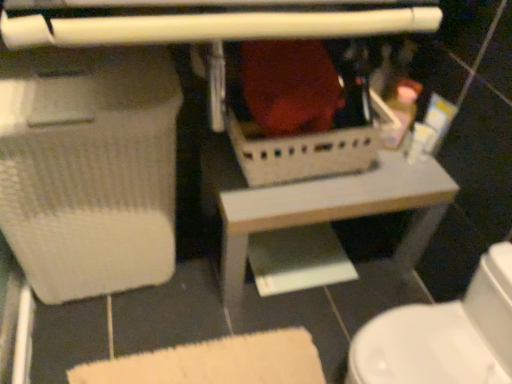
What do you see at coordinates (443, 335) in the screenshot?
I see `white glossy toilet at lower right` at bounding box center [443, 335].

Measure the distance between white glossy toilet at lower right and camera.

The depth of white glossy toilet at lower right is 86.60 centimeters.

Locate an element on the screen. This screenshot has width=512, height=384. white glossy toilet at lower right is located at coordinates (443, 335).

What is the approximate height of white glossy toilet at lower right?

The height of white glossy toilet at lower right is 38.71 centimeters.

Locate an element on the screen. The image size is (512, 384). white plastic basket at center is located at coordinates (319, 204).

The height and width of the screenshot is (384, 512). What do you see at coordinates (319, 204) in the screenshot?
I see `white plastic basket at center` at bounding box center [319, 204].

Where is `white glossy toilet at lower right`? The width and height of the screenshot is (512, 384). white glossy toilet at lower right is located at coordinates (443, 335).

Considering the positions of objects white glossy toilet at lower right and white plastic basket at center in the image provided, who is more to the right, white glossy toilet at lower right or white plastic basket at center?

white glossy toilet at lower right is more to the right.

Is the position of white glossy toilet at lower right more distant than that of white plastic basket at center?

No.

Considering the positions of points (474, 329) and (205, 163), is point (474, 329) farther from camera compared to point (205, 163)?

No, (474, 329) is in front of (205, 163).

From the image's perspective, is white glossy toilet at lower right located above white plastic basket at center?

No.

From a real-world perspective, which is physically below, white glossy toilet at lower right or white plastic basket at center?

white plastic basket at center, from a real-world perspective.

In terms of width, does white glossy toilet at lower right look wider or thinner when compared to white plastic basket at center?

In the image, white glossy toilet at lower right appears to be more narrow than white plastic basket at center.

Who is taller, white glossy toilet at lower right or white plastic basket at center?

Standing taller between the two is white glossy toilet at lower right.

Can you confirm if white glossy toilet at lower right is smaller than white plastic basket at center?

Correct, white glossy toilet at lower right occupies less space than white plastic basket at center.

In the scene shown: Is white glossy toilet at lower right completely or partially outside of white plastic basket at center?

Yes.

Would you consider white glossy toilet at lower right to be distant from white plastic basket at center?

No, there isn't a large distance between white glossy toilet at lower right and white plastic basket at center.

Could you tell me if white glossy toilet at lower right is turned towards white plastic basket at center?

No, white glossy toilet at lower right is not aimed at white plastic basket at center.

Can you tell me how much white glossy toilet at lower right and white plastic basket at center differ in facing direction?

The angle between the facing direction of white glossy toilet at lower right and the facing direction of white plastic basket at center is 91.2 degrees.

Identify the location of table below the white glossy toilet at lower right (from a real-world perspective). (319, 204).

Does white plastic basket at center appear on the left side of white glossy toilet at lower right?

Yes, white plastic basket at center is to the left of white glossy toilet at lower right.

Who is more distant, white plastic basket at center or white glossy toilet at lower right?

white plastic basket at center is further from the camera.

Which is closer to the camera, (424, 219) or (394, 366)?

Point (424, 219) is farther from the camera than point (394, 366).

From the image's perspective, which one is positioned higher, white plastic basket at center or white glossy toilet at lower right?

white plastic basket at center, from the image's perspective.

From a real-world perspective, is white plastic basket at center positioned under white glossy toilet at lower right based on gravity?

Yes, from a real-world perspective, white plastic basket at center is under white glossy toilet at lower right.

Can you confirm if white plastic basket at center is wider than white glossy toilet at lower right?

Yes.

Does white plastic basket at center have a lesser height compared to white glossy toilet at lower right?

Indeed, white plastic basket at center has a lesser height compared to white glossy toilet at lower right.

Between white plastic basket at center and white glossy toilet at lower right, which one has smaller size?

Smaller between the two is white glossy toilet at lower right.

Would you say white plastic basket at center is outside white glossy toilet at lower right?

Yes, white plastic basket at center is outside of white glossy toilet at lower right.

Would you say white plastic basket at center is a long distance from white glossy toilet at lower right?

No, there isn't a large distance between white plastic basket at center and white glossy toilet at lower right.

Is white plastic basket at center positioned with its back to white glossy toilet at lower right?

No, white plastic basket at center is not facing the opposite direction of white glossy toilet at lower right.

Can you tell me how much white plastic basket at center and white glossy toilet at lower right differ in facing direction?

The angle between the facing direction of white plastic basket at center and the facing direction of white glossy toilet at lower right is 91.2 degrees.

Consider the image. How distant is white plastic basket at center from white glossy toilet at lower right?

white plastic basket at center and white glossy toilet at lower right are 32.09 centimeters apart from each other.

What are the coordinates of `toilet that appears on the right of white plastic basket at center` in the screenshot? It's located at (443, 335).

In order to click on toilet on the right side of white plastic basket at center in this screenshot , I will do `click(443, 335)`.

Where is `toilet that is above the white plastic basket at center (from a real-world perspective)`? toilet that is above the white plastic basket at center (from a real-world perspective) is located at coordinates [x=443, y=335].